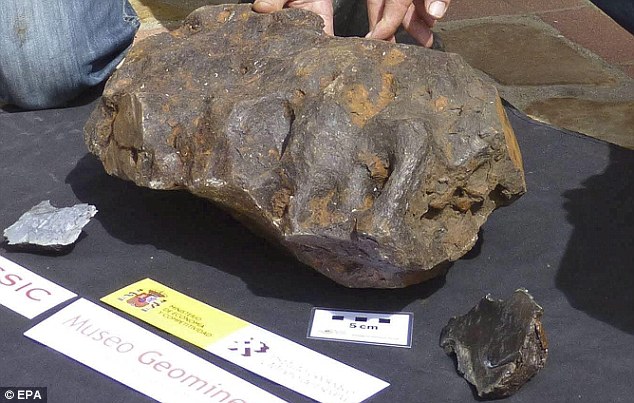
This screenshot has width=634, height=403. I want to click on black table cloth, so click(x=574, y=384).